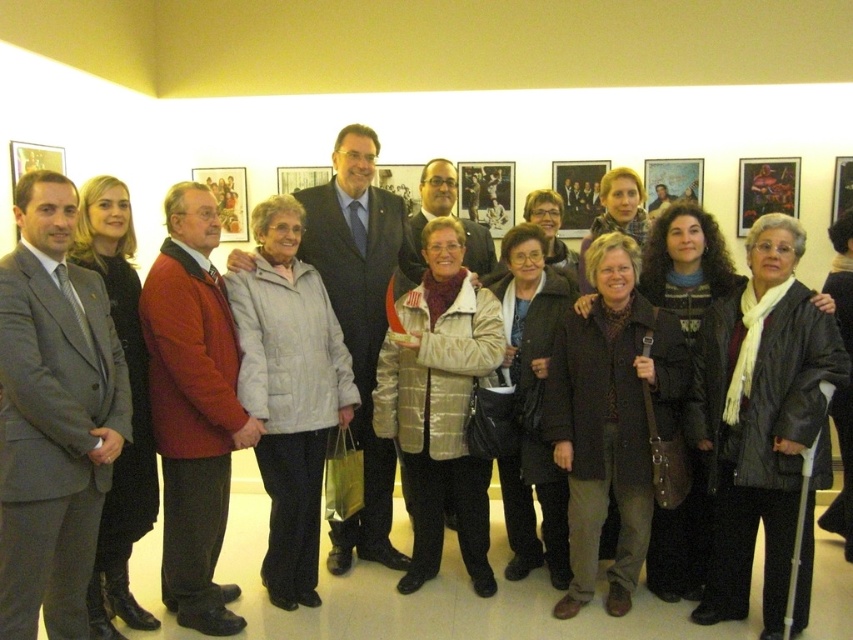
This screenshot has width=853, height=640. What are the coordinates of `white leather jacket at center` in the screenshot? It's located at (761, 419).

Which is more to the left, white leather jacket at center or light gray quilted jacket at center?

light gray quilted jacket at center is more to the left.

Which is behind, point (700, 337) or point (247, 352)?

The point (700, 337) is more distant.

At what (x,y) coordinates should I click in order to perform the action: click on white leather jacket at center. Please return your answer as a coordinate pair (x, y). Looking at the image, I should click on (x=761, y=419).

How much distance is there between white leather jacket at center and red woolen jacket at center?

The distance of white leather jacket at center from red woolen jacket at center is 5.89 feet.

Which is more to the right, white leather jacket at center or red woolen jacket at center?

Positioned to the right is white leather jacket at center.

Is point (819, 429) positioned before point (177, 310)?

Yes, point (819, 429) is closer to viewer.

Locate an element on the screen. This screenshot has height=640, width=853. white leather jacket at center is located at coordinates (761, 419).

Is point (44, 310) farther from camera compared to point (186, 477)?

No, it is in front of (186, 477).

Is point (74, 444) less distant than point (167, 333)?

Yes, it is in front of point (167, 333).

Which is in front, point (90, 499) or point (207, 536)?

Point (90, 499)

You are a GUI agent. You are given a task and a screenshot of the screen. Output one action in this format:
    pyautogui.click(x=<x>, y=<y>)
    Task: Click on the gray suit at left
    
    Given the screenshot: What is the action you would take?
    pyautogui.click(x=53, y=416)